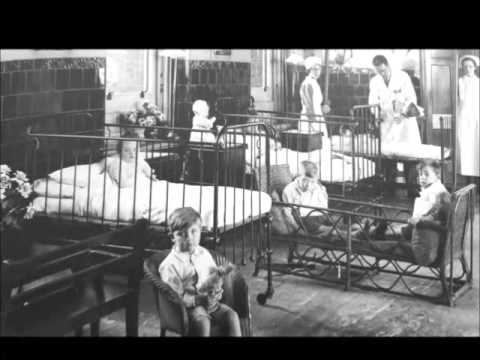
The height and width of the screenshot is (360, 480). Find the location of `stuffed animal`. stuffed animal is located at coordinates coord(208,292).